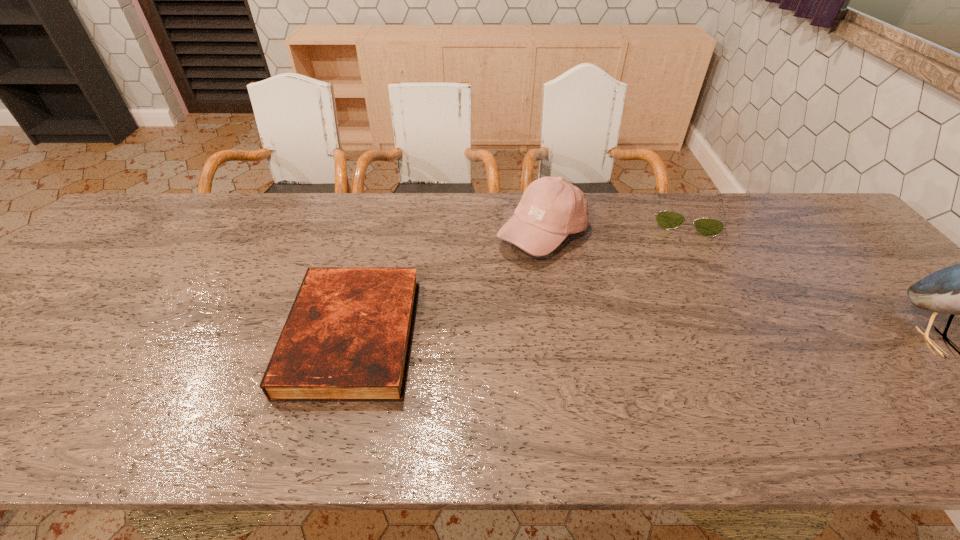
This screenshot has height=540, width=960. In order to click on the leftmost object in this screenshot , I will do `click(347, 338)`.

You are a GUI agent. You are given a task and a screenshot of the screen. Output one action in this format:
    pyautogui.click(x=<x>, y=<y>)
    Task: Click on the second tallest object
    
    Given the screenshot: What is the action you would take?
    pyautogui.click(x=551, y=208)

You are a GUI agent. You are given a task and a screenshot of the screen. Output one action in this format:
    pyautogui.click(x=<x>, y=<y>)
    Task: Click on the second object from left to right
    
    Given the screenshot: What is the action you would take?
    pyautogui.click(x=551, y=208)

The image size is (960, 540). Identify the location of the third object from left to right. (708, 227).

What are the coordinates of `free space located on the spine side of the Bible` in the screenshot? It's located at (131, 336).

In order to click on blank area located on the spine side of the Bible in this screenshot , I will do `click(144, 336)`.

Locate an element on the screen. The width and height of the screenshot is (960, 540). free space located on the spine side of the Bible is located at coordinates (272, 336).

Find the location of a particular element. vacant space situated on the front-facing side of the third object from right to left is located at coordinates (591, 314).

I want to click on vacant region located on the front-facing side of the third object from right to left, so click(x=603, y=333).

I want to click on free region located 0.280m on the front-facing side of the third object from right to left, so click(x=612, y=346).